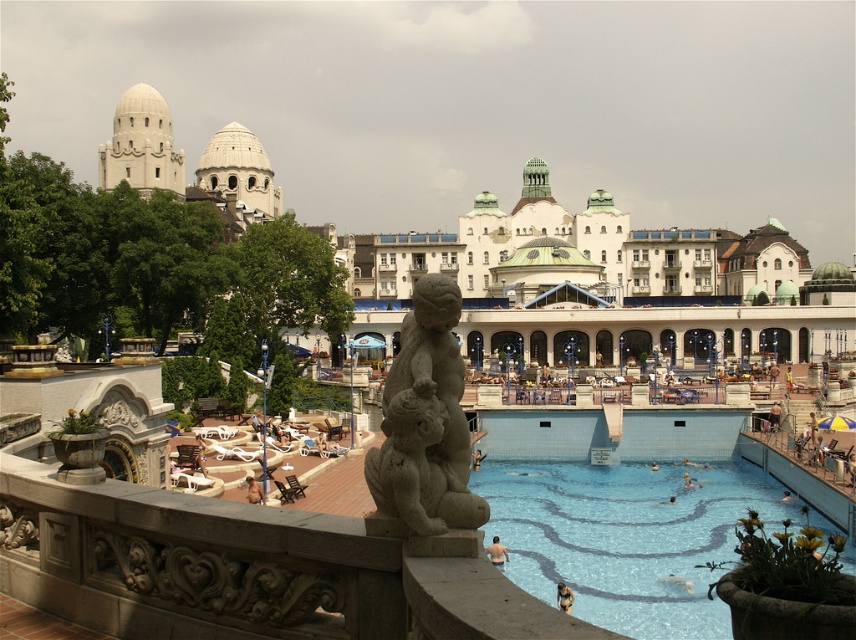
Question: Does blue tile swimming pool at lower right appear on the left side of gray stone sculpture at center?

Choices:
 (A) yes
 (B) no

Answer: (B)

Question: Is blue tile swimming pool at lower right below gray stone sculpture at center?

Choices:
 (A) yes
 (B) no

Answer: (A)

Question: Among these objects, which one is nearest to the camera?

Choices:
 (A) gray stone sculpture at center
 (B) blue tile swimming pool at lower right

Answer: (A)

Question: Which of the following is the closest to the observer?

Choices:
 (A) (706, 580)
 (B) (446, 509)

Answer: (B)

Question: Does blue tile swimming pool at lower right have a smaller size compared to gray stone sculpture at center?

Choices:
 (A) no
 (B) yes

Answer: (A)